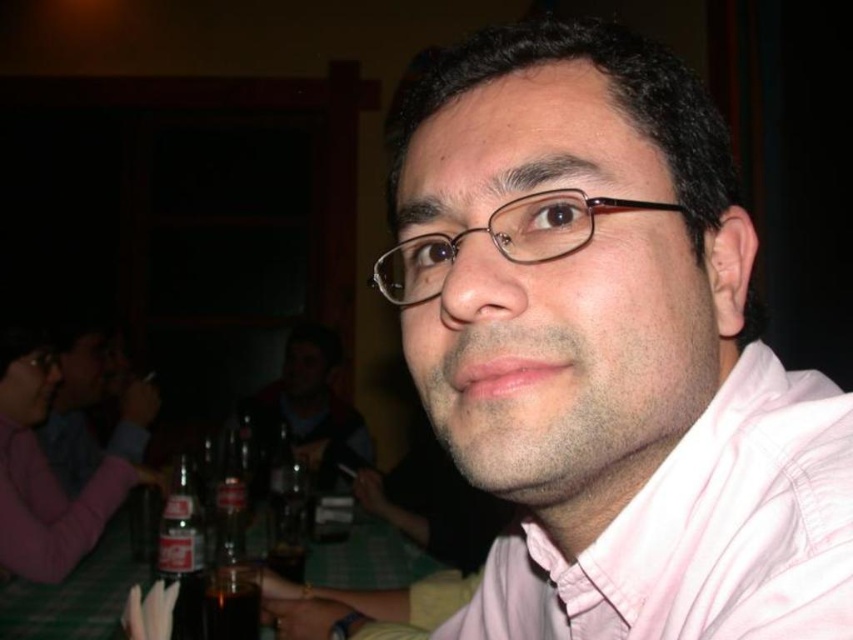
The scene shows a person wearing a pink cotton dress shirt at center and a brown glass bottle at center on the table. Which object is closer to the viewer?

The pink cotton dress shirt at center is closer to the viewer because it is located above the brown glass bottle at center.

You are at a social event and want to place a small gift on the green fabric table at lower left without it being blocked by the matte black shirt at center. Is the table accessible from your current position?

The green fabric table at lower left is in front of the matte black shirt at center, so the table is accessible and not blocked by the shirt.

You are a bartender who needs to place a coaster between the matte black shirt at center and the brown glass bottle at center. The coaster is 1 foot in diameter. Can you fit the coaster between them without moving either item?

The distance between the matte black shirt at center and the brown glass bottle at center is 3.97 feet. Since the coaster is only 1 foot in diameter, there is enough space to place it between them without moving either item.